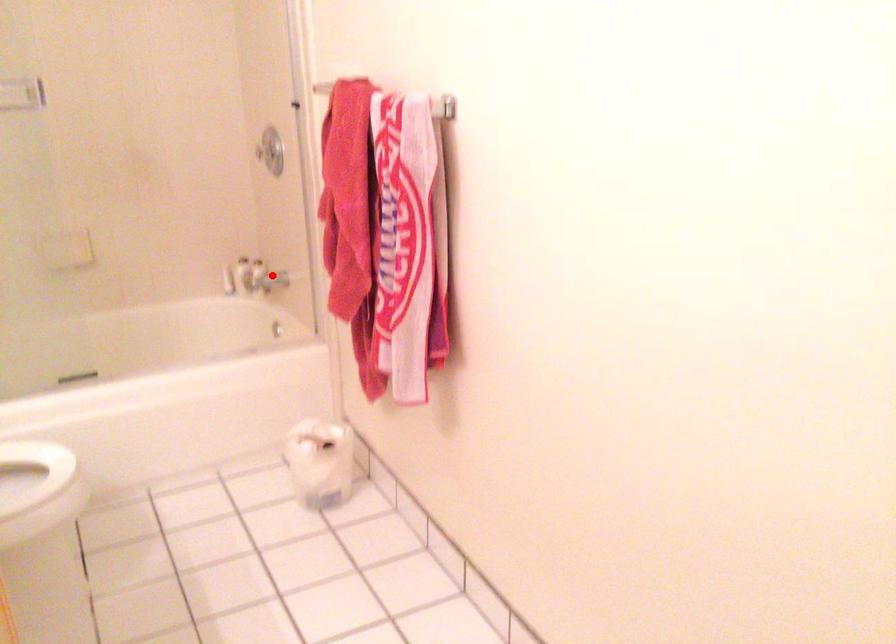
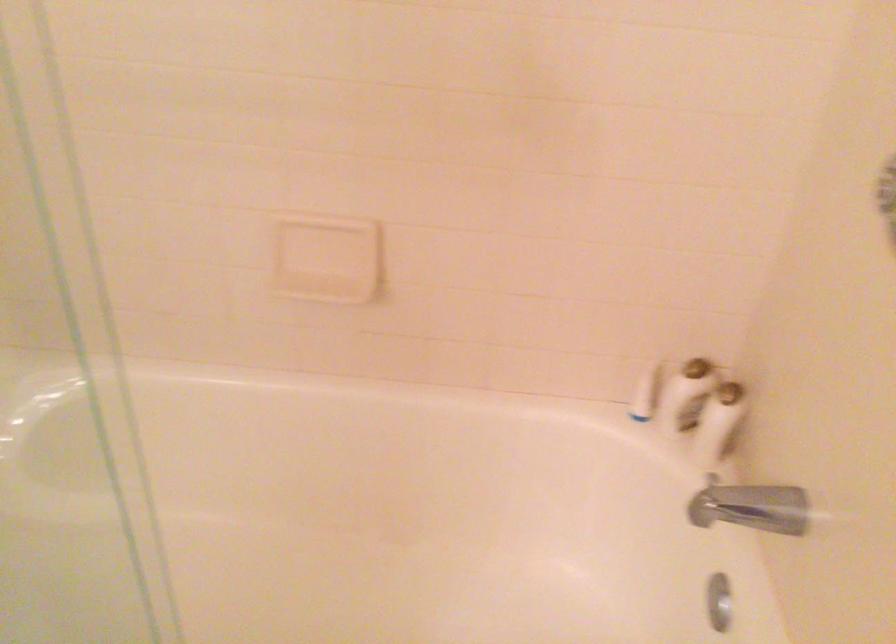
Locate, in the second image, the point that corresponds to the highlighted location in the first image.

(757, 507)